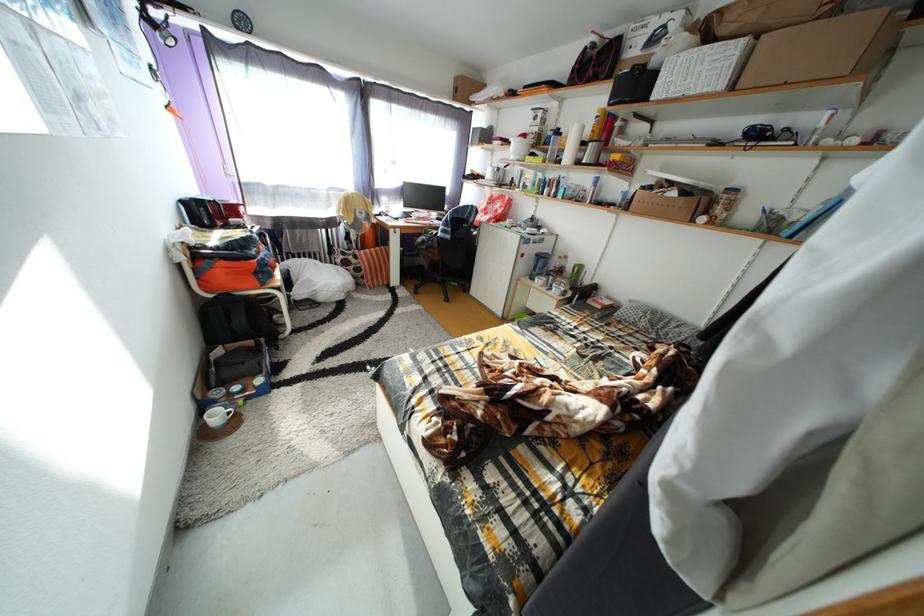
Find where to lift the red plastic bottle. Please return your answer as a coordinate pair (x, y).

(608, 128)